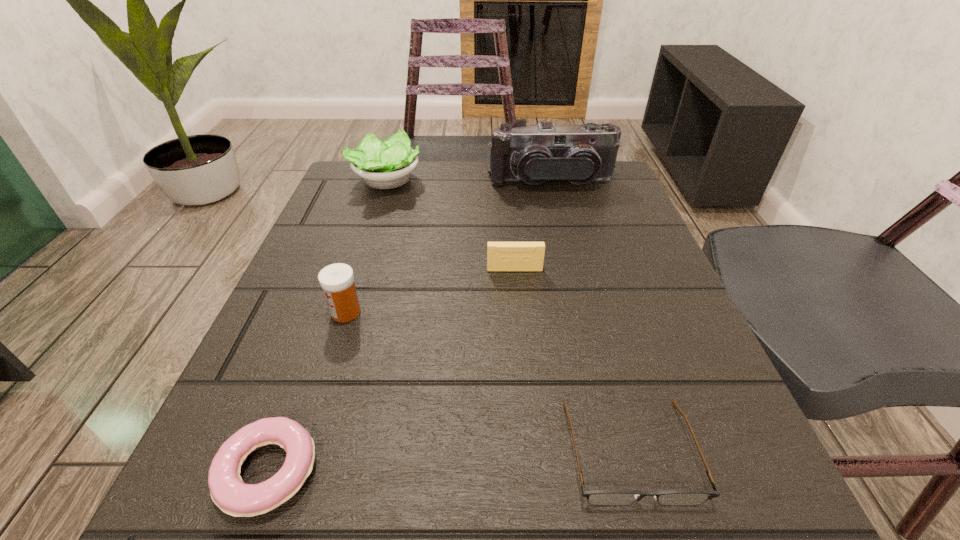
In order to click on free location located at the front of the fourth nearest object with spools in this screenshot , I will do `click(530, 438)`.

Where is `vacant space located on the right of the doughnut`? Image resolution: width=960 pixels, height=540 pixels. vacant space located on the right of the doughnut is located at coordinates point(562,471).

Locate an element on the screen. camcorder present at the far edge is located at coordinates (545, 153).

You are a GUI agent. You are given a task and a screenshot of the screen. Output one action in this format:
    pyautogui.click(x=<x>, y=<y>)
    Task: Click on the lettuce positioned at the far edge
    This screenshot has width=960, height=540.
    Given the screenshot: What is the action you would take?
    pyautogui.click(x=387, y=164)

You are a GUI agent. You are given a task and a screenshot of the screen. Output one action in this format:
    pyautogui.click(x=<x>, y=<y>)
    Task: Click on the spectacles that is at the near edge
    
    Given the screenshot: What is the action you would take?
    pyautogui.click(x=595, y=497)

Where is `doughnut that is at the near edge`? The width and height of the screenshot is (960, 540). doughnut that is at the near edge is located at coordinates (234, 497).

Find the location of a particular element. The width and height of the screenshot is (960, 540). lettuce at the left edge is located at coordinates (387, 164).

Where is `medicine that is at the left edge`? The width and height of the screenshot is (960, 540). medicine that is at the left edge is located at coordinates (337, 280).

Find the location of `doughnut at the left edge`. doughnut at the left edge is located at coordinates (234, 497).

Locate an element on the screen. This screenshot has height=540, width=960. camcorder located in the right edge section of the desktop is located at coordinates (x=545, y=153).